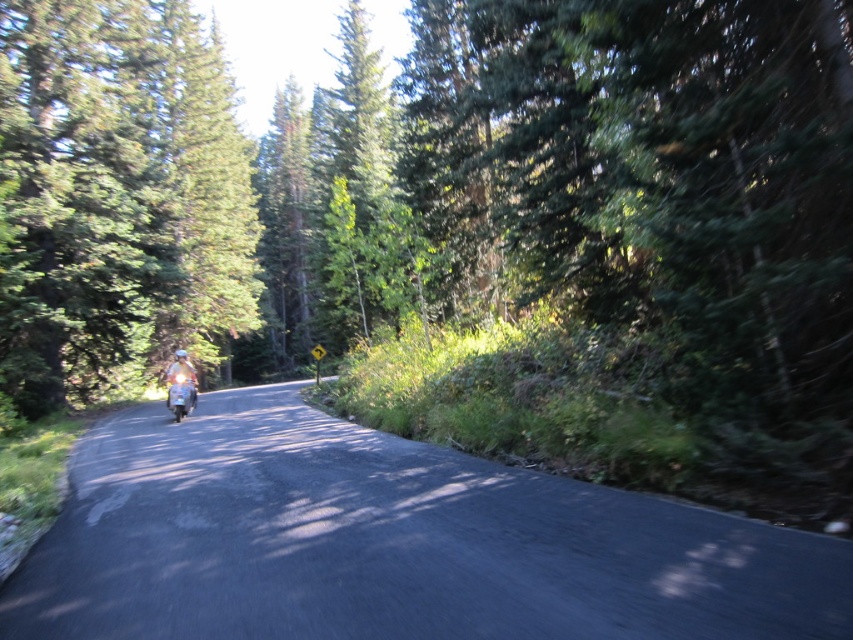
This screenshot has height=640, width=853. What do you see at coordinates (180, 394) in the screenshot?
I see `shiny silver motorcycle at center` at bounding box center [180, 394].

Does shiny silver motorcycle at center have a lesser width compared to metallic silver helmet at center?

Indeed, shiny silver motorcycle at center has a lesser width compared to metallic silver helmet at center.

Does point (183, 406) come in front of point (184, 352)?

That is True.

Locate an element on the screen. shiny silver motorcycle at center is located at coordinates (180, 394).

From the picture: Can you confirm if green textured tree at left is taller than shiny silver motorcycle at center?

Yes, green textured tree at left is taller than shiny silver motorcycle at center.

Does green textured tree at left lie behind shiny silver motorcycle at center?

No, green textured tree at left is closer to the viewer.

Between point (35, 160) and point (173, 396), which one is positioned in front?

Point (173, 396) is in front.

At what (x,y) coordinates should I click in order to perform the action: click on green textured tree at left. Please return your answer as a coordinate pair (x, y). The height and width of the screenshot is (640, 853). Looking at the image, I should click on (117, 196).

Does green textured tree at left appear over metallic silver helmet at center?

Yes, green textured tree at left is above metallic silver helmet at center.

Identify the location of green textured tree at left. This screenshot has width=853, height=640. (117, 196).